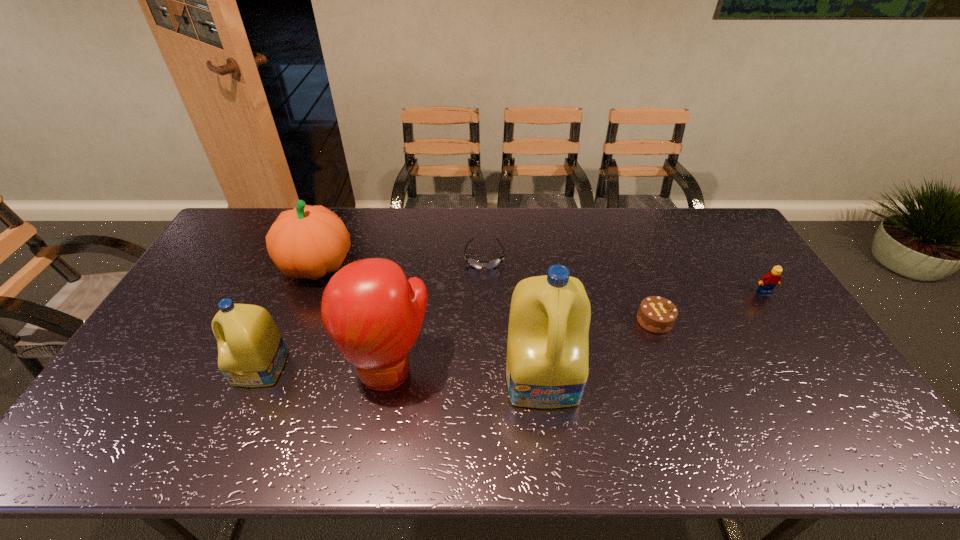
Image resolution: width=960 pixels, height=540 pixels. Identify the location of the left detergent. (251, 352).

Where is `the taller detergent`? the taller detergent is located at coordinates 547,367.

Where is `the shortest object`? The image size is (960, 540). the shortest object is located at coordinates (493, 264).

Find the location of a particular element. The width and height of the screenshot is (960, 540). Lego is located at coordinates tap(768, 282).

The height and width of the screenshot is (540, 960). I want to click on the fifth tallest object, so pos(768,282).

The width and height of the screenshot is (960, 540). What are the coordinates of `pumpkin` in the screenshot? It's located at (309, 242).

Where is `the second shortest object`? the second shortest object is located at coordinates (656, 314).

The image size is (960, 540). Find the location of `the fourth nearest object`. the fourth nearest object is located at coordinates (656, 314).

This screenshot has width=960, height=540. I want to click on the fifth object from right to left, so coord(373,314).

Where is `free spot located on the label of the left detergent`? free spot located on the label of the left detergent is located at coordinates (154, 369).